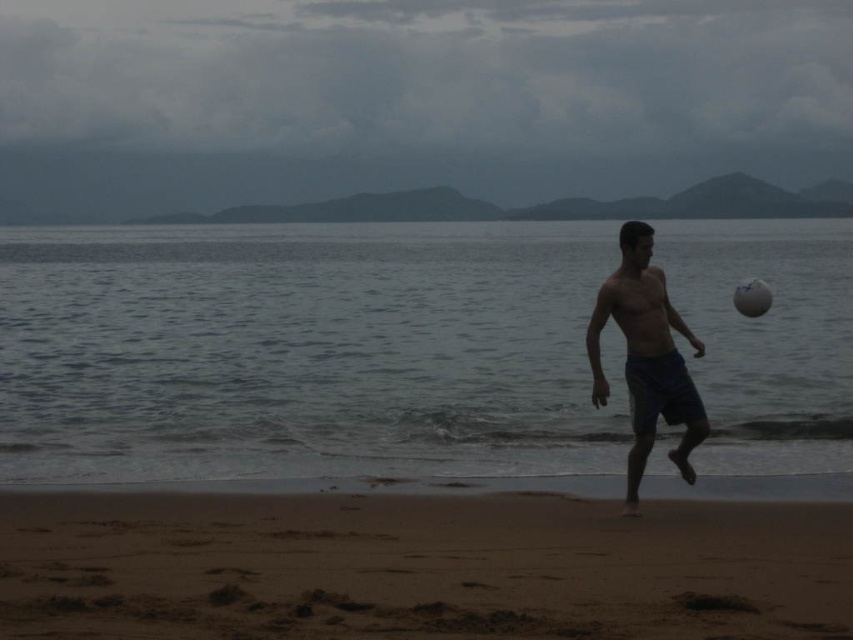
Is clear water at lower center above white matte volleyball at center?

Correct, clear water at lower center is located above white matte volleyball at center.

Measure the distance between clear water at lower center and camera.

clear water at lower center is 36.30 feet from camera.

Find the location of a particular element. The height and width of the screenshot is (640, 853). clear water at lower center is located at coordinates (305, 353).

Which is in front, point (215, 324) or point (386, 536)?

Positioned in front is point (386, 536).

Does clear water at lower center appear on the right side of brown sandy beach at lower center?

No, clear water at lower center is not to the right of brown sandy beach at lower center.

Image resolution: width=853 pixels, height=640 pixels. In order to click on clear water at lower center in this screenshot , I will do `click(305, 353)`.

Is point (532, 500) closer to camera compared to point (770, 298)?

That is True.

Who is higher up, brown sandy beach at lower center or white matte volleyball at center?

white matte volleyball at center is higher up.

Is point (142, 612) closer to viewer compared to point (747, 289)?

Yes, it is.

This screenshot has height=640, width=853. In order to click on brown sandy beach at lower center in this screenshot , I will do `click(418, 568)`.